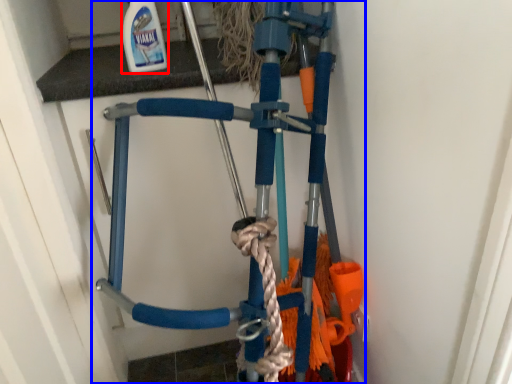
Question: Among these objects, which one is farthest to the camera, cleaning product (highlighted by a red box) or bicycle (highlighted by a blue box)?

Choices:
 (A) cleaning product
 (B) bicycle

Answer: (B)